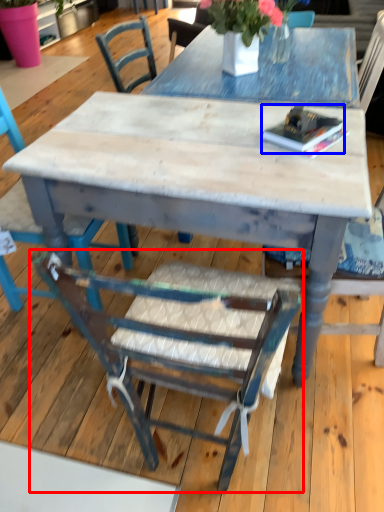
Question: Which point is closer to the camera, chair (highlighted by a red box) or book (highlighted by a blue box)?

Choices:
 (A) chair
 (B) book

Answer: (A)